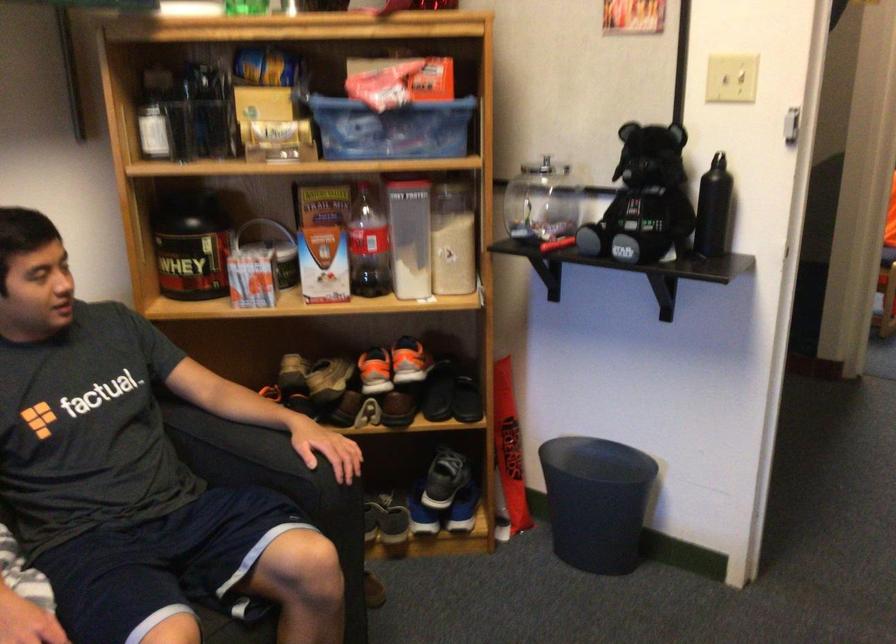
The height and width of the screenshot is (644, 896). In order to click on coca-cola bottle in this screenshot , I will do point(367,245).